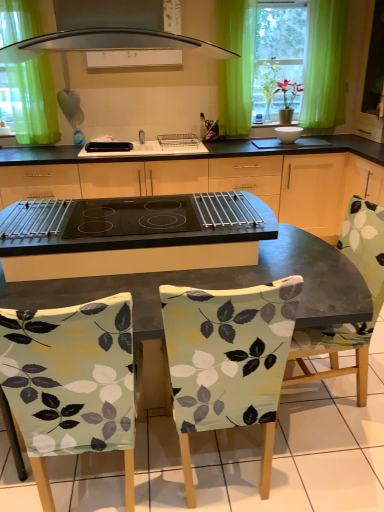
Question: Does black glass cooktop at center have a lesser width compared to white glossy bowl at center, which is the 1th appliance from right to left?

Choices:
 (A) yes
 (B) no

Answer: (B)

Question: From the image's perspective, would you say black glass cooktop at center is positioned over white glossy bowl at center, positioned as the 2th appliance in left-to-right order?

Choices:
 (A) no
 (B) yes

Answer: (A)

Question: From the image's perspective, would you say black glass cooktop at center is shown under white glossy bowl at center, which is the 1th appliance from right to left?

Choices:
 (A) yes
 (B) no

Answer: (A)

Question: From a real-world perspective, is black glass cooktop at center over white glossy bowl at center, positioned as the 2th appliance in left-to-right order?

Choices:
 (A) no
 (B) yes

Answer: (A)

Question: Does black glass cooktop at center have a smaller size compared to white glossy bowl at center, positioned as the 2th appliance in left-to-right order?

Choices:
 (A) yes
 (B) no

Answer: (B)

Question: Does black glass cooktop at center appear on the right side of white glossy bowl at center, which is the 1th appliance from right to left?

Choices:
 (A) yes
 (B) no

Answer: (B)

Question: From the image's perspective, would you say green fabric curtain at upper left, which is counted as the 1th curtain, starting from the left, is shown under green sheer curtain at upper center, which ranks as the 2th curtain in left-to-right order?

Choices:
 (A) yes
 (B) no

Answer: (A)

Question: From a real-world perspective, does green fabric curtain at upper left, which is counted as the 1th curtain, starting from the left, stand above green sheer curtain at upper center, which ranks as the 2th curtain in left-to-right order?

Choices:
 (A) no
 (B) yes

Answer: (B)

Question: Is green fabric curtain at upper left, the 2th curtain in the right-to-left sequence, in contact with green sheer curtain at upper center, which appears as the first curtain when viewed from the right?

Choices:
 (A) no
 (B) yes

Answer: (A)

Question: Is green fabric curtain at upper left, which is counted as the 1th curtain, starting from the left, shorter than green sheer curtain at upper center, which ranks as the 2th curtain in left-to-right order?

Choices:
 (A) no
 (B) yes

Answer: (A)

Question: Can you confirm if green fabric curtain at upper left, the 2th curtain in the right-to-left sequence, is positioned to the right of green sheer curtain at upper center, which ranks as the 2th curtain in left-to-right order?

Choices:
 (A) yes
 (B) no

Answer: (B)

Question: Can you confirm if green fabric curtain at upper left, the 2th curtain in the right-to-left sequence, is smaller than green sheer curtain at upper center, which ranks as the 2th curtain in left-to-right order?

Choices:
 (A) yes
 (B) no

Answer: (B)

Question: Considering the relative positions of green fabric curtain at upper left, which is counted as the 1th curtain, starting from the left, and black glass cooktop at center in the image provided, is green fabric curtain at upper left, which is counted as the 1th curtain, starting from the left, to the right of black glass cooktop at center from the viewer's perspective?

Choices:
 (A) no
 (B) yes

Answer: (A)